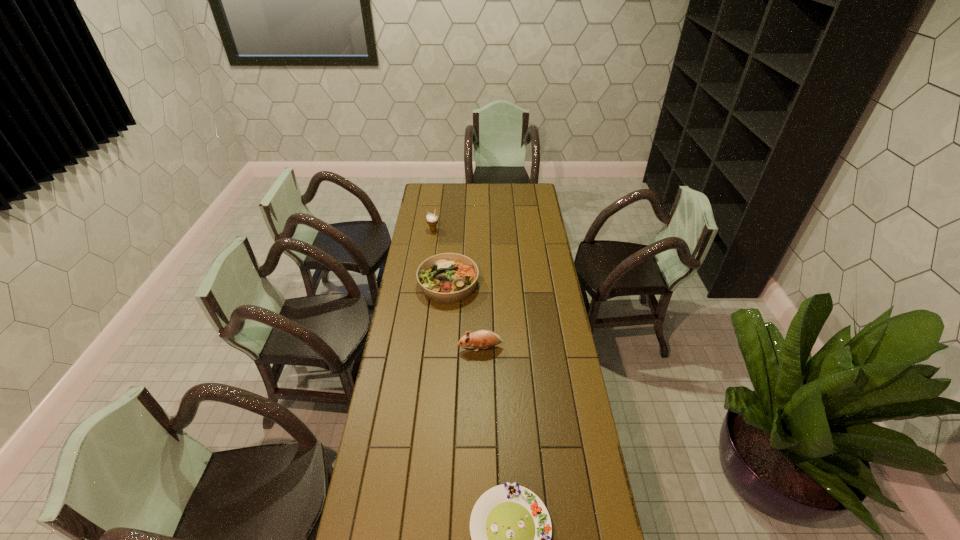
This screenshot has width=960, height=540. Find the location of `icecream`. icecream is located at coordinates (432, 219).

Identify the location of the tallest object. (432, 219).

What are the coordinates of `the second nearest object` in the screenshot? It's located at (484, 339).

In order to click on the farther salad plate in this screenshot , I will do `click(446, 278)`.

Find the location of `the second farthest object`. the second farthest object is located at coordinates (446, 278).

Identify the location of free location located on the back of the icecream. The image size is (960, 540). (436, 208).

What are the coordinates of `vacant space located at the face of the hamster` in the screenshot? It's located at (437, 348).

You are a GUI agent. You are given a task and a screenshot of the screen. Output one action in this format:
    pyautogui.click(x=<x>, y=<y>)
    Task: Click on the vacant area located 0.080m at the face of the hamster
    The image size is (960, 540).
    Given the screenshot: What is the action you would take?
    pyautogui.click(x=440, y=348)

Image resolution: width=960 pixels, height=540 pixels. Find the location of `vacant space positioned at the face of the hamster`. vacant space positioned at the face of the hamster is located at coordinates (435, 348).

The height and width of the screenshot is (540, 960). Identify the location of vacant space situated 0.210m on the back of the third nearest object. (452, 241).